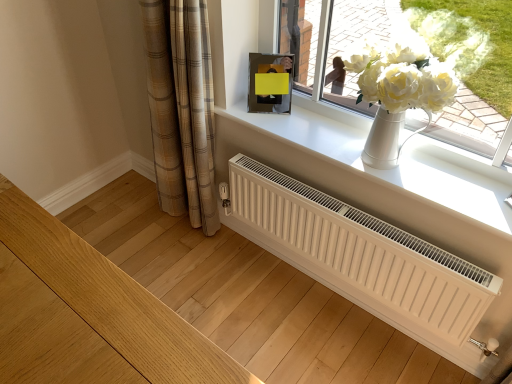
Locate an element on the screen. Image resolution: width=512 pixels, height=384 pixels. free space that is to the left of plaid fabric curtain at lower left is located at coordinates (137, 224).